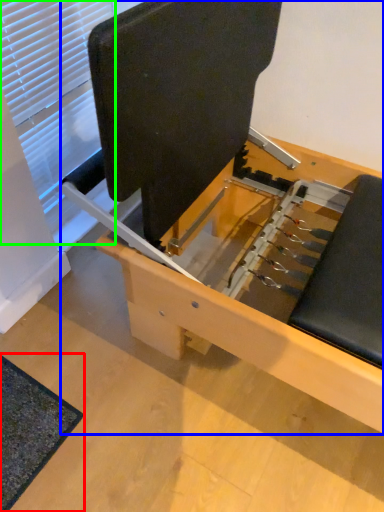
Question: Which object is the farthest from mat (highlighted by a red box)? Choose among these: furniture (highlighted by a blue box) or window (highlighted by a green box).

Choices:
 (A) furniture
 (B) window

Answer: (B)